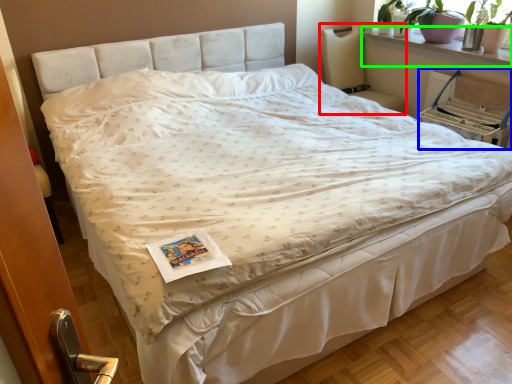
Question: Which object is positioned closest to rocking chair (highlighted by a red box)? Select from armchair (highlighted by a blue box) and window sill (highlighted by a green box).

Choices:
 (A) armchair
 (B) window sill

Answer: (B)